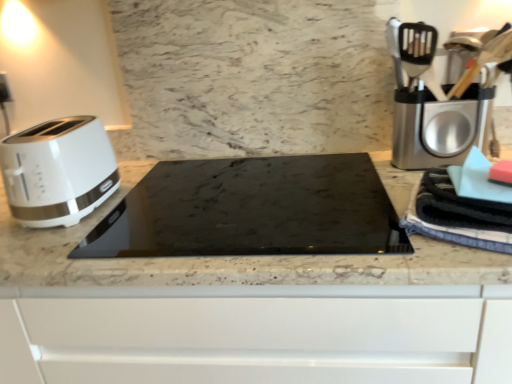
Question: From the image's perspective, is blue striped towel at right above marble at center?

Choices:
 (A) yes
 (B) no

Answer: (A)

Question: Is blue striped towel at right to the right of marble at center from the viewer's perspective?

Choices:
 (A) yes
 (B) no

Answer: (A)

Question: Could you tell me if blue striped towel at right is facing marble at center?

Choices:
 (A) yes
 (B) no

Answer: (B)

Question: Is blue striped towel at right looking in the opposite direction of marble at center?

Choices:
 (A) yes
 (B) no

Answer: (B)

Question: Considering the relative positions of blue striped towel at right and marble at center in the image provided, is blue striped towel at right behind marble at center?

Choices:
 (A) no
 (B) yes

Answer: (B)

Question: From the image's perspective, is blue striped towel at right below marble at center?

Choices:
 (A) no
 (B) yes

Answer: (A)

Question: Are marble at center and black glass cooktop at center far apart?

Choices:
 (A) yes
 (B) no

Answer: (B)

Question: Is marble at center turned away from black glass cooktop at center?

Choices:
 (A) no
 (B) yes

Answer: (A)

Question: From the image's perspective, is marble at center located above black glass cooktop at center?

Choices:
 (A) no
 (B) yes

Answer: (A)

Question: Can you confirm if marble at center is thinner than black glass cooktop at center?

Choices:
 (A) yes
 (B) no

Answer: (B)

Question: Is marble at center to the right of black glass cooktop at center from the viewer's perspective?

Choices:
 (A) yes
 (B) no

Answer: (B)

Question: From the image's perspective, is marble at center under black glass cooktop at center?

Choices:
 (A) yes
 (B) no

Answer: (A)

Question: From the image's perspective, is marble at center located beneath white glossy toaster at left?

Choices:
 (A) no
 (B) yes

Answer: (B)